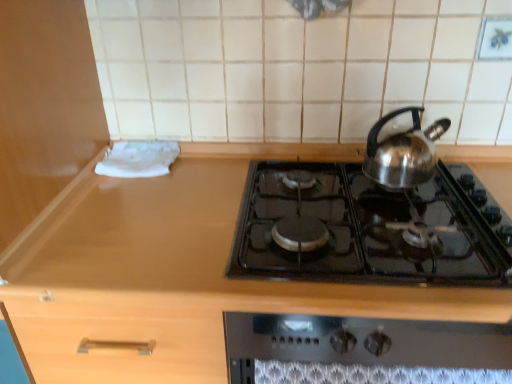
You are a GUI agent. You are given a task and a screenshot of the screen. Output one action in this format:
    pyautogui.click(x=<x>, y=<y>)
    Task: Click on the vacant region above wooden counter at center (from a real-world perspective)
    The height and width of the screenshot is (384, 512).
    Given the screenshot: What is the action you would take?
    pyautogui.click(x=266, y=217)